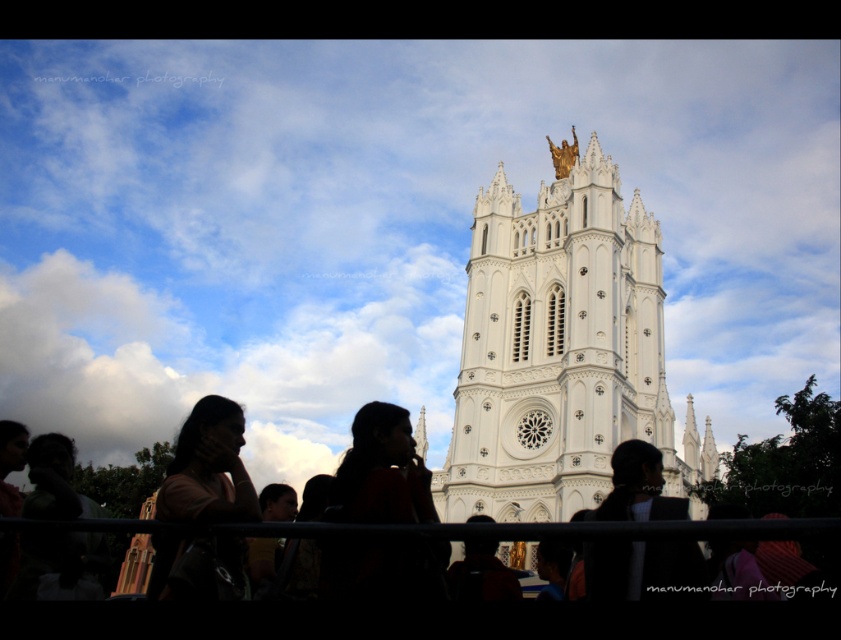
Which is more to the left, matte pink shirt at lower left or dark brown leather backpack at center?

matte pink shirt at lower left is more to the left.

This screenshot has height=640, width=841. What do you see at coordinates (209, 468) in the screenshot?
I see `matte pink shirt at lower left` at bounding box center [209, 468].

Locate an element on the screen. matte pink shirt at lower left is located at coordinates (209, 468).

Can you confirm if dark brown leather backpack at center is shorter than white stone spire at center?

Yes, dark brown leather backpack at center is shorter than white stone spire at center.

Can you confirm if dark brown leather backpack at center is bigger than white stone spire at center?

Yes.

Which is behind, point (496, 582) or point (421, 408)?

Point (421, 408)

Where is `dark brown leather backpack at center`? dark brown leather backpack at center is located at coordinates (480, 573).

From the picture: Measure the distance between dark red fabric at center and camera.

dark red fabric at center is 105.74 feet away from camera.

Does dark red fabric at center appear on the left side of black fabric at center?

Yes, dark red fabric at center is to the left of black fabric at center.

Is point (361, 444) positioned after point (678, 515)?

Yes.

Locate an element on the screen. dark red fabric at center is located at coordinates (381, 472).